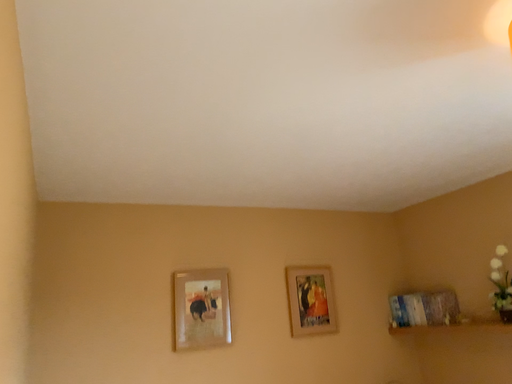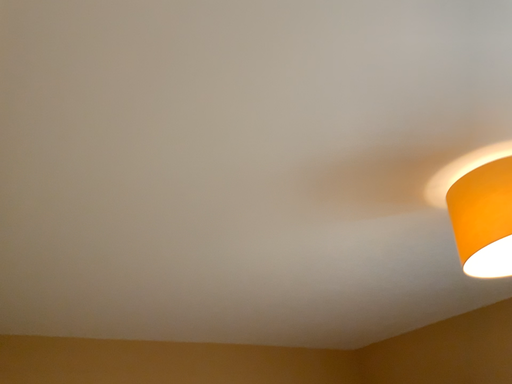
Question: Which way did the camera rotate in the video?

Choices:
 (A) rotated upward
 (B) rotated downward

Answer: (A)